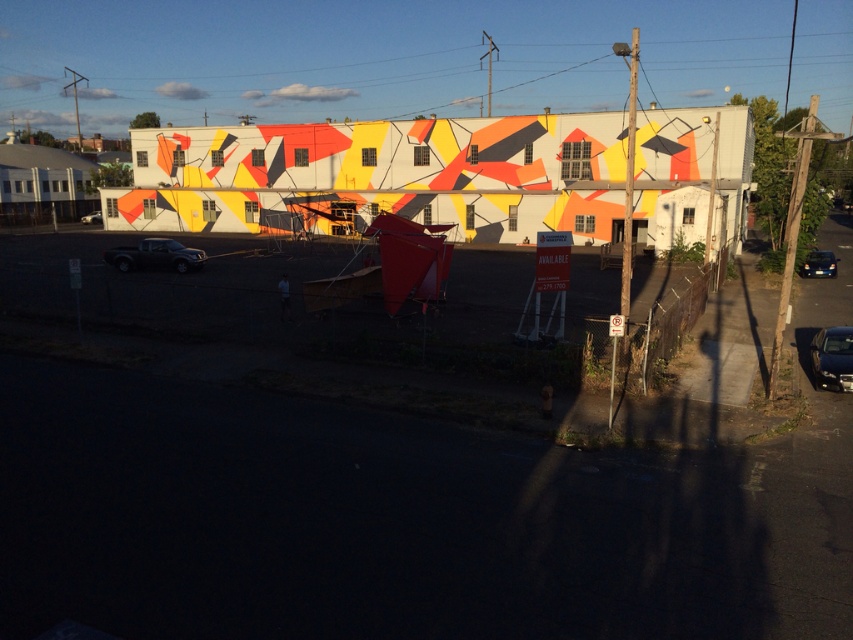
Question: Can you confirm if metallic blue sedan at lower right is positioned below matte black truck at center-left?

Choices:
 (A) no
 (B) yes

Answer: (B)

Question: Does matte black truck at lower left have a smaller size compared to black matte car at lower right?

Choices:
 (A) yes
 (B) no

Answer: (B)

Question: Which of the following is the farthest from the observer?

Choices:
 (A) matte black truck at center-left
 (B) metallic blue sedan at lower right

Answer: (A)

Question: Which point appears farthest from the camera in this image?

Choices:
 (A) (834, 372)
 (B) (154, 259)
 (C) (822, 257)
 (D) (83, 218)

Answer: (D)

Question: Which point appears farthest from the camera in this image?

Choices:
 (A) (86, 216)
 (B) (181, 264)

Answer: (A)

Question: Is metallic blue sedan at lower right positioned at the back of black matte car at lower right?

Choices:
 (A) yes
 (B) no

Answer: (B)